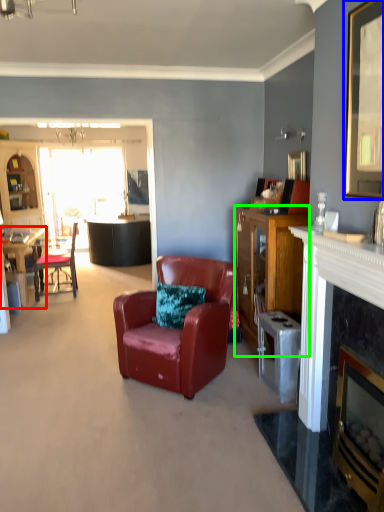
Question: Which is farther away from desk (highlighted by a red box)? picture frame (highlighted by a blue box) or cabinetry (highlighted by a green box)?

Choices:
 (A) picture frame
 (B) cabinetry

Answer: (A)